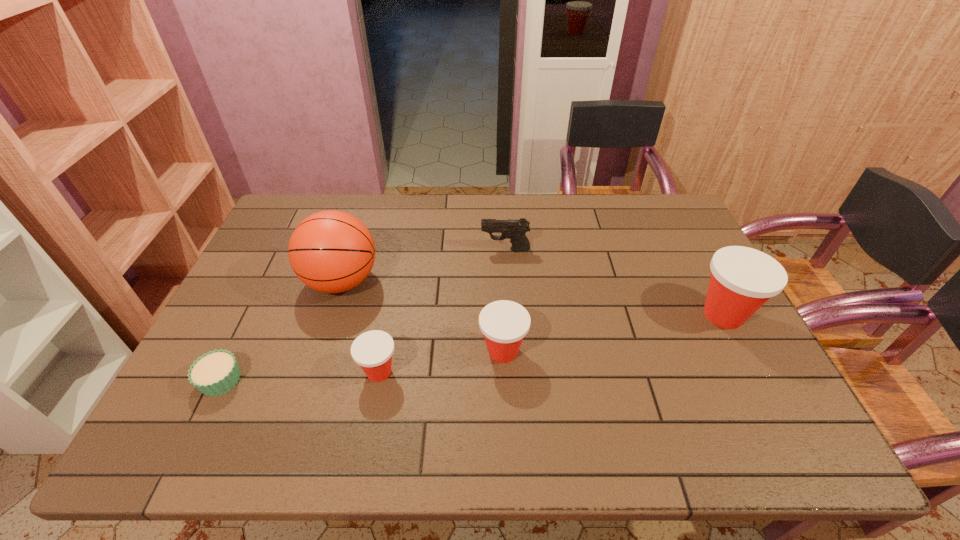
Locate an element on the screen. The height and width of the screenshot is (540, 960). vacant space situated 0.230m on the left of the second Dixie cup from left to right is located at coordinates (388, 352).

This screenshot has width=960, height=540. In order to click on free space located 0.110m on the back of the fifth shortest object in this screenshot , I will do `click(698, 267)`.

Identify the location of free location located 0.260m at the barrel of the pistol. (399, 249).

Locate an element on the screen. vacant space situated at the barrel of the pistol is located at coordinates (409, 249).

I want to click on vacant space located 0.200m at the barrel of the pistol, so click(418, 249).

Where is `vacant space located 0.110m on the front of the basketball`? This screenshot has height=540, width=960. vacant space located 0.110m on the front of the basketball is located at coordinates (323, 342).

Where is `free space located 0.310m on the right of the cupcake`? Image resolution: width=960 pixels, height=540 pixels. free space located 0.310m on the right of the cupcake is located at coordinates (372, 380).

Identify the location of Dixie cup that is positioned at the near edge. (372, 350).

This screenshot has width=960, height=540. I want to click on cupcake present at the near edge, so click(215, 373).

Find the location of a particular element. The width and height of the screenshot is (960, 540). object that is at the left edge is located at coordinates (215, 373).